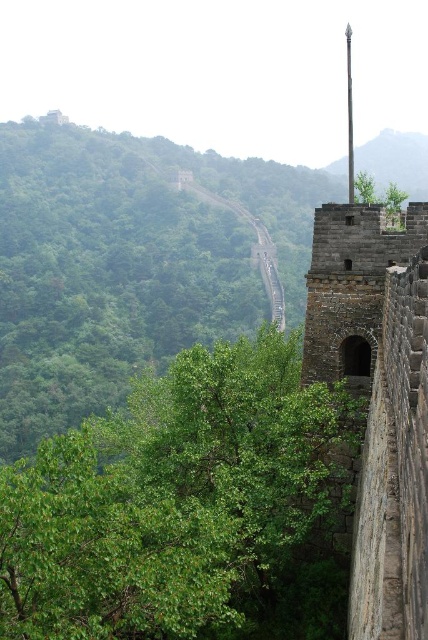
From the picture: Is green leafy tree at center-left below green leafy tree at upper center?

Yes.

In the scene shown: Which is more to the left, green leafy tree at center-left or green leafy tree at upper center?

From the viewer's perspective, green leafy tree at center-left appears more on the left side.

Does point (139, 429) come farther from viewer compared to point (369, 193)?

Yes, point (139, 429) is behind point (369, 193).

Where is `green leafy tree at center-left`? The image size is (428, 640). green leafy tree at center-left is located at coordinates (187, 508).

Is green leafy tree at center-left bigger than green stone wall at upper center?

No.

Can you confirm if green leafy tree at center-left is thinner than green stone wall at upper center?

Correct, green leafy tree at center-left's width is less than green stone wall at upper center's.

Between point (42, 611) and point (425, 182), which one is positioned behind?

The point (425, 182) is behind.

At what (x,y) coordinates should I click in order to perform the action: click on green leafy tree at center-left. Please return your answer as a coordinate pair (x, y). The height and width of the screenshot is (640, 428). Looking at the image, I should click on [x=187, y=508].

Who is more forward, (412, 138) or (354, 188)?

Point (354, 188) is in front.

The height and width of the screenshot is (640, 428). Identify the location of green stone wall at upper center. (395, 161).

You are a GUI agent. You are given a task and a screenshot of the screen. Output one action in this format:
    pyautogui.click(x=<x>, y=<y>)
    Task: Click on the green stone wall at upper center
    
    Given the screenshot: What is the action you would take?
    pyautogui.click(x=395, y=161)